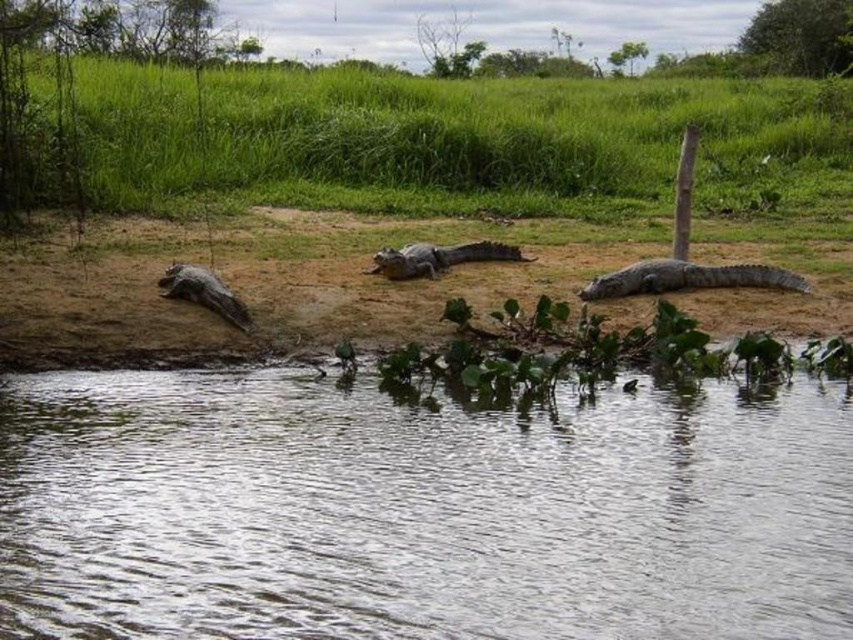
Is point (518, 106) more distant than point (206, 292)?

Yes, it is behind point (206, 292).

Is green grass at upper center shorter than dark gray scaly crocodile at left?

No.

Locate an element on the screen. green grass at upper center is located at coordinates (450, 138).

Locate an element on the screen. green grass at upper center is located at coordinates (450, 138).

Does point (209, 80) come in front of point (421, 259)?

No, (209, 80) is behind (421, 259).

Does point (234, 168) come behind point (436, 252)?

Yes, point (234, 168) is behind point (436, 252).

Does point (567, 150) come behind point (376, 257)?

Yes, it is.

Locate an element on the screen. green grass at upper center is located at coordinates (450, 138).

Can you confirm if grayish-green scaly crocodile at center is shorter than dark gray scaly crocodile at left?

Correct, grayish-green scaly crocodile at center is not as tall as dark gray scaly crocodile at left.

This screenshot has width=853, height=640. What do you see at coordinates (438, 257) in the screenshot?
I see `grayish-green scaly crocodile at center` at bounding box center [438, 257].

Identify the location of grayish-green scaly crocodile at center. (438, 257).